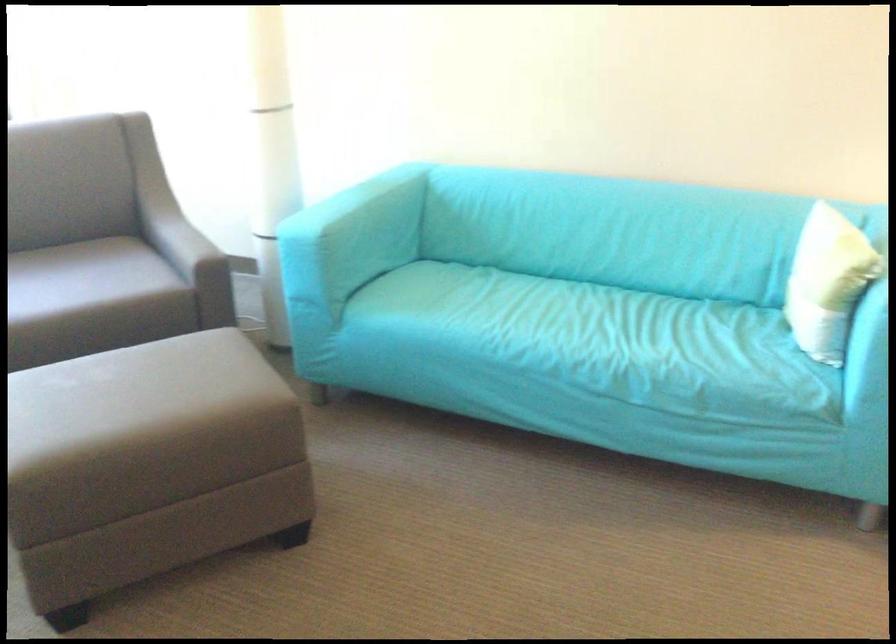
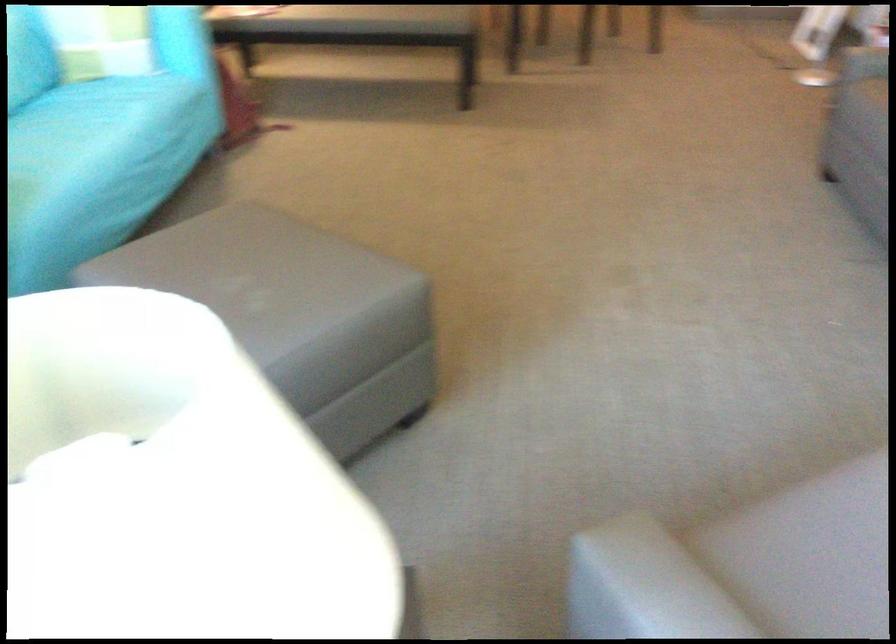
In the second image, find the point that corresponds to (x=754, y=272) in the first image.

(101, 29)